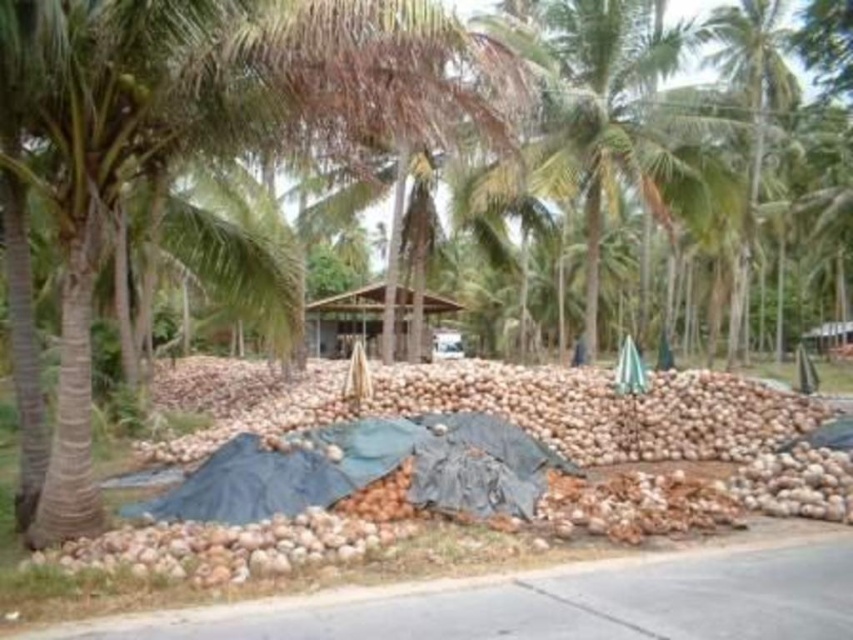
Question: Which is nearer to the green leafy palm tree at upper right?

Choices:
 (A) green leafy palm tree at center
 (B) brown wooden hut at center

Answer: (A)

Question: Based on their relative distances, which object is farther from the brown wooden hut at center?

Choices:
 (A) green leafy palm tree at upper right
 (B) green leafy palm tree at center

Answer: (A)

Question: Which of the following is the farthest from the observer?

Choices:
 (A) brown wooden hut at center
 (B) green leafy palm tree at center
 (C) green leafy palm tree at upper right

Answer: (A)

Question: Can you confirm if green leafy palm tree at center is wider than brown wooden hut at center?

Choices:
 (A) yes
 (B) no

Answer: (A)

Question: Can you confirm if green leafy palm tree at center is positioned above green leafy palm tree at upper right?

Choices:
 (A) yes
 (B) no

Answer: (A)

Question: Does green leafy palm tree at upper right come behind brown wooden hut at center?

Choices:
 (A) no
 (B) yes

Answer: (A)